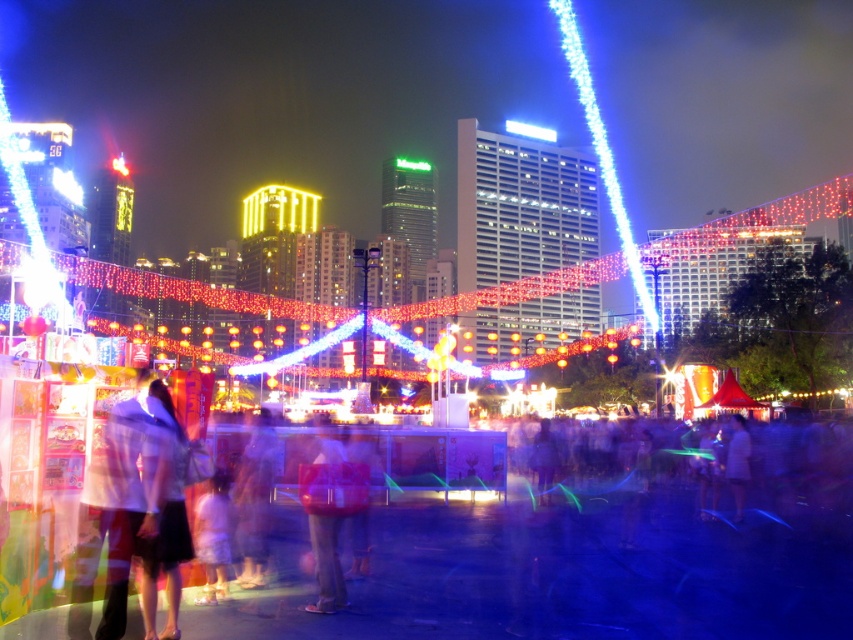
Question: Among these points, which one is farthest from the camera?

Choices:
 (A) (339, 456)
 (B) (746, 444)

Answer: (B)

Question: Does light pink fabric dress at center have a smaller size compared to translucent plastic bag at center?

Choices:
 (A) yes
 (B) no

Answer: (B)

Question: Which object is closer to the camera taking this photo?

Choices:
 (A) translucent plastic bag at center
 (B) light pink fabric dress at center
 (C) light brown fabric shirt at center

Answer: (B)

Question: Which of the following is the farthest from the observer?

Choices:
 (A) translucent plastic bag at center
 (B) light brown fabric shirt at center
 (C) light pink fabric dress at center

Answer: (A)

Question: Does light brown fabric shirt at center appear over translucent plastic bag at center?

Choices:
 (A) no
 (B) yes

Answer: (B)

Question: Is light brown fabric shirt at center thinner than translucent plastic bag at center?

Choices:
 (A) no
 (B) yes

Answer: (A)